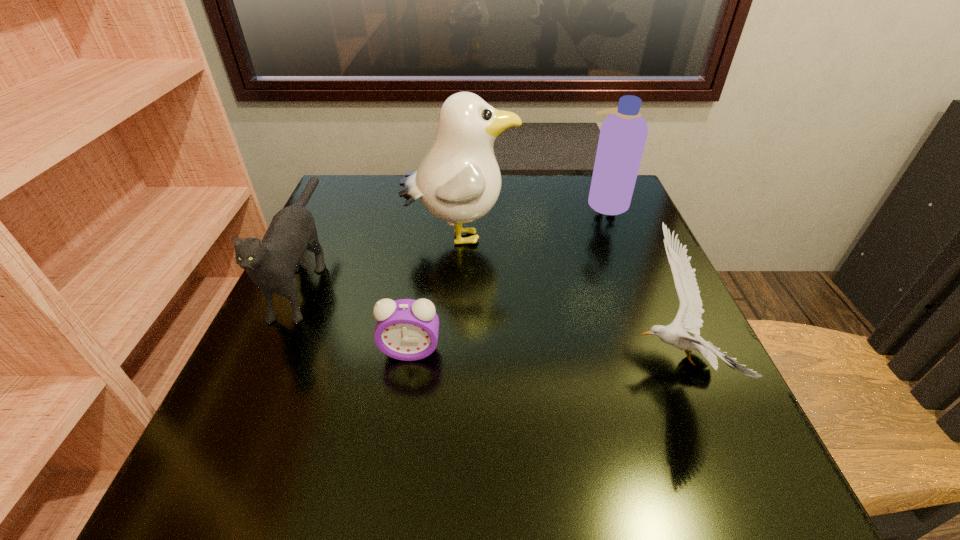
Locate an element on the screen. vacant space located 0.250m at the tip of the beak of the right gull is located at coordinates (483, 361).

This screenshot has width=960, height=540. What are the coordinates of `vacant area situated at the tip of the beak of the right gull` in the screenshot? It's located at (435, 361).

At what (x,y) coordinates should I click in order to perform the action: click on blank space located 0.230m at the tip of the beak of the right gull. Please return your answer as a coordinate pair (x, y). This screenshot has width=960, height=540. Looking at the image, I should click on (495, 361).

Where is `free region located 0.130m on the face of the shortest object`? Image resolution: width=960 pixels, height=540 pixels. free region located 0.130m on the face of the shortest object is located at coordinates (398, 434).

Identify the location of gull at the far edge. The image size is (960, 540). (459, 181).

Find the location of a particular element. shampoo that is at the far edge is located at coordinates (623, 134).

Where is `cat that is at the far edge`? Image resolution: width=960 pixels, height=540 pixels. cat that is at the far edge is located at coordinates (271, 264).

The height and width of the screenshot is (540, 960). Identify the location of object that is positioned at the near edge. (688, 319).

The width and height of the screenshot is (960, 540). What are the coordinates of `object at the left edge` in the screenshot? It's located at (271, 264).

You are a GUI agent. You are given a task and a screenshot of the screen. Output one action in this format:
    pyautogui.click(x=<x>, y=<y>)
    Task: Click on the shampoo present at the right edge
    
    Given the screenshot: What is the action you would take?
    pyautogui.click(x=623, y=134)